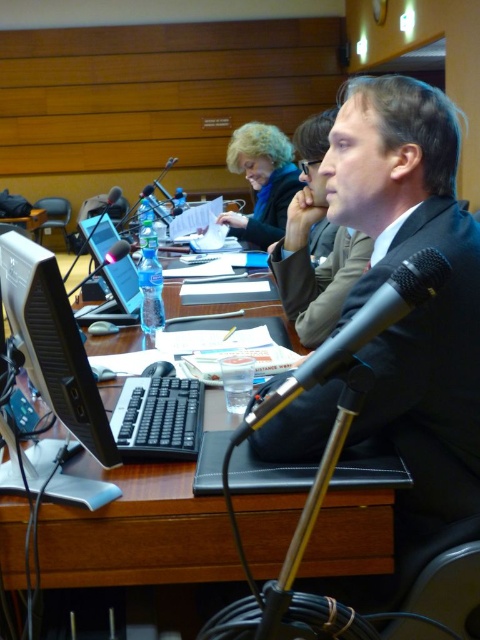
You are a photographer setting up for a conference. You need to place a new camera stand between the black metallic microphone at center and the matte black jacket at upper center. Based on the scene, which side of the microphone should you place it to ensure it aligns with the existing setup?

The black metallic microphone at center is positioned on the right side of matte black jacket at upper center. To align with the existing setup, the camera stand should be placed to the left of the black metallic microphone at center, which is the same side as the matte black jacket at upper center.

You are a sound technician preparing for a live event. You have a microphone stand that requires the microphone to be placed exactly 20 inches away from the audience. Based on the scene described, will the current placement of the black metallic microphone at center meet this requirement?

The black metallic microphone at center is 21.15 inches away from the viewer, which is slightly more than the required 20 inches. Therefore, the current placement does not meet the requirement and needs adjustment to bring it closer by approximately 1.15 inches.

You are a technician adjusting the positions of the black glossy monitor at center and the black metallic microphone at center on the desk. The monitor must be placed exactly 15 inches away from the microphone. Currently, they are 13.87 inches apart. Should you move the monitor closer or farther away from the microphone to meet the requirement?

The black glossy monitor at center is currently 13.87 inches away from the black metallic microphone at center. To reach the required 15 inches, you should move the monitor farther away from the microphone by approximately 1.13 inches.